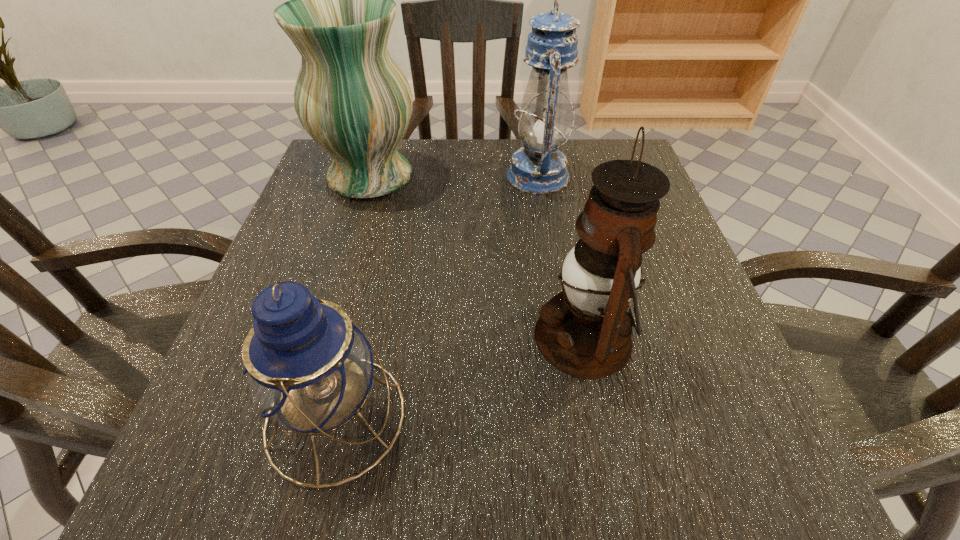
The image size is (960, 540). Identify the location of vase that is at the far edge. (351, 97).

Where is `object at the near edge`? This screenshot has height=540, width=960. object at the near edge is located at coordinates (309, 367).

Identify the location of vase that is at the left edge. The image size is (960, 540). (351, 97).

Find the location of a particular element. This screenshot has width=960, height=540. lantern positioned at the left edge is located at coordinates (309, 367).

The width and height of the screenshot is (960, 540). In order to click on object that is at the right edge in this screenshot , I will do `click(585, 331)`.

Locate an element on the screen. This screenshot has width=960, height=540. object located in the far left corner section of the desktop is located at coordinates (351, 97).

Where is `object present at the near left corner`? The height and width of the screenshot is (540, 960). object present at the near left corner is located at coordinates (309, 367).

Find the location of `free space at the far edge of the desktop`. free space at the far edge of the desktop is located at coordinates (400, 197).

Locate an element on the screen. This screenshot has height=540, width=960. vacant area at the near edge of the desktop is located at coordinates (534, 473).

The width and height of the screenshot is (960, 540). What are the coordinates of `blank space at the left edge` in the screenshot? It's located at (340, 284).